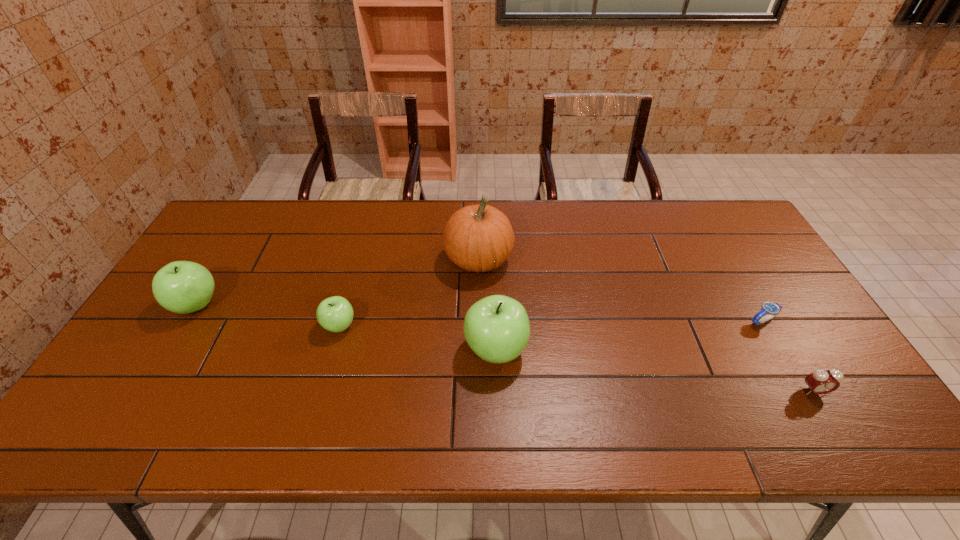
Where is `free space located 0.350m on the left of the second apple from right to left`? free space located 0.350m on the left of the second apple from right to left is located at coordinates (193, 326).

This screenshot has height=540, width=960. I want to click on vacant space located 0.050m on the back of the rightmost apple, so click(x=494, y=310).

Identify the location of free space located 0.280m on the stem of the tallest object. Image resolution: width=960 pixels, height=540 pixels. (602, 260).

The image size is (960, 540). What are the coordinates of `free space located 0.100m on the left of the watch` in the screenshot? It's located at (710, 321).

Find the location of a particular element. object that is at the far edge is located at coordinates (478, 238).

Where is `apple that is at the near edge`? Image resolution: width=960 pixels, height=540 pixels. apple that is at the near edge is located at coordinates (497, 328).

The image size is (960, 540). In order to click on alarm clock at the near edge in this screenshot , I will do `click(821, 381)`.

Identify the location of object at the left edge. This screenshot has height=540, width=960. (183, 287).

Identify the location of watch that is at the right edge. (771, 309).

You are a GUI agent. You are given a task and a screenshot of the screen. Output one action in this format:
    pyautogui.click(x=<x>, y=<y>)
    Task: Click on the alarm clock present at the right edge
    
    Given the screenshot: What is the action you would take?
    pyautogui.click(x=821, y=381)